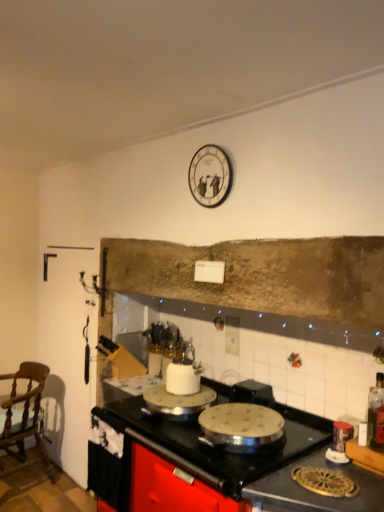
The height and width of the screenshot is (512, 384). I want to click on blank space above black matte countertop at center (from a real-world perspective), so click(x=230, y=401).